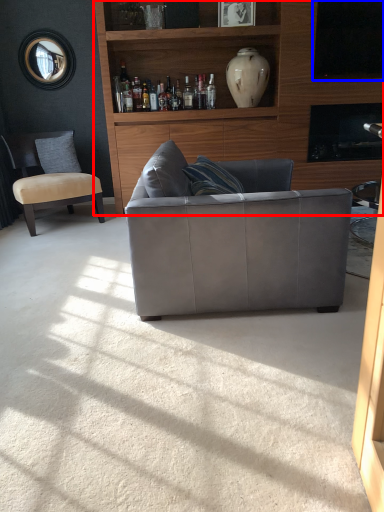
Question: Which point is further to the camera, entertainment center (highlighted by a red box) or window screen (highlighted by a blue box)?

Choices:
 (A) entertainment center
 (B) window screen

Answer: (B)